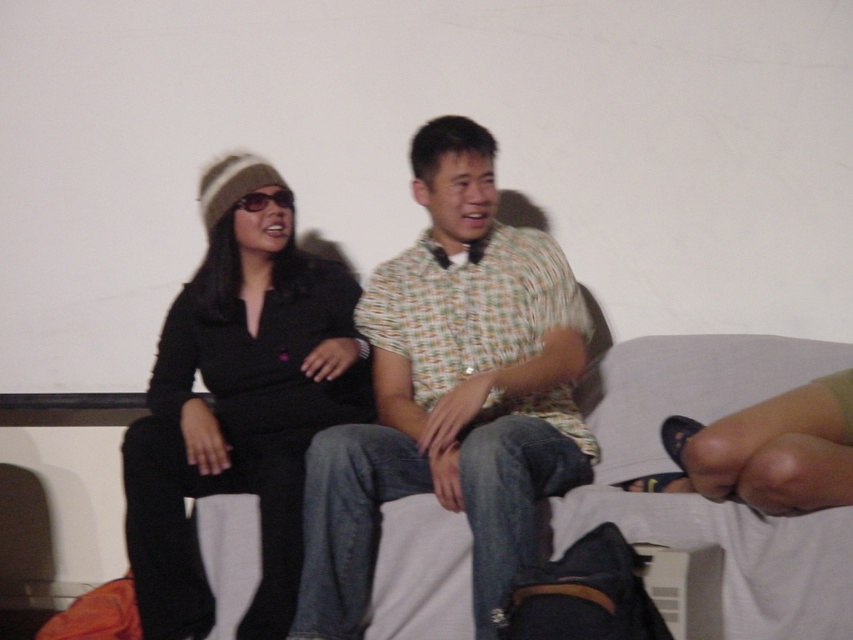
You are a photographer setting up a photo shoot. You need to ensure that both the checkered fabric shirt at center and the black matte shirt at left are fully visible in the frame. Given their widths, which shirt requires a wider camera frame to accommodate its size?

The checkered fabric shirt at center requires a wider camera frame because its width surpasses that of the black matte shirt at left.

You are a photographer setting up for a group photo. You notice the checkered fabric shirt at center and the black matte shirt at left in the frame. Based on their positions, which shirt should you adjust to ensure both are fully visible in the photo?

The checkered fabric shirt at center is taller than the black matte shirt at left, so you should lower the angle or position of the checkered fabric shirt at center to ensure both are fully visible in the photo.

You are a photographer setting up for a group photo. You need to ensure there is enough space between the checkered fabric shirt at center and the black matte shirt at left to avoid overlapping in the frame. The minimum required distance for no overlap is 10 inches. Is the current distance sufficient?

The checkered fabric shirt at center is 9.32 inches from the black matte shirt at left. Since the required distance is 10 inches, the current spacing is insufficient to prevent overlap in the frame.